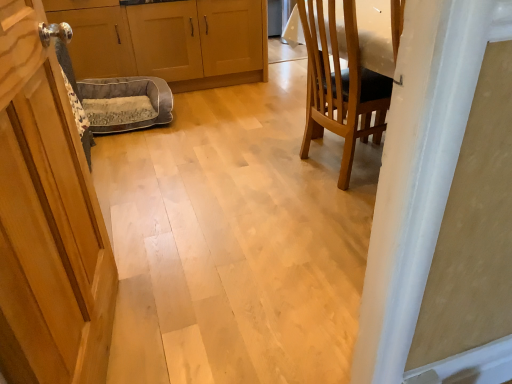
Measure the distance between point (x=375, y=93) and camera.

Point (x=375, y=93) is 1.95 meters away from camera.

What do you see at coordinates (96, 37) in the screenshot? I see `wooden cabinet at left, which appears as the second cabinetry when viewed from the right` at bounding box center [96, 37].

This screenshot has width=512, height=384. I want to click on wooden chair at right, so click(x=340, y=84).

Is matte wood cabinets at center, positioned as the first cabinetry in right-to-left order, at the back of wooden chair at right?

wooden chair at right does not have its back to matte wood cabinets at center, positioned as the first cabinetry in right-to-left order.

Considering the sizes of objects wooden chair at right and matte wood cabinets at center, acting as the 2th cabinetry starting from the left, in the image provided, who is wider, wooden chair at right or matte wood cabinets at center, acting as the 2th cabinetry starting from the left,?

matte wood cabinets at center, acting as the 2th cabinetry starting from the left, is wider.

Does wooden chair at right have a larger size compared to matte wood cabinets at center, positioned as the first cabinetry in right-to-left order?

Actually, wooden chair at right might be smaller than matte wood cabinets at center, positioned as the first cabinetry in right-to-left order.

Is matte wood cabinets at center, positioned as the first cabinetry in right-to-left order, positioned far away from wooden door at left?

matte wood cabinets at center, positioned as the first cabinetry in right-to-left order, is positioned a significant distance from wooden door at left.

Can you confirm if matte wood cabinets at center, positioned as the first cabinetry in right-to-left order, is smaller than wooden door at left?

Actually, matte wood cabinets at center, positioned as the first cabinetry in right-to-left order, might be larger than wooden door at left.

Is matte wood cabinets at center, positioned as the first cabinetry in right-to-left order, shorter than wooden door at left?

Indeed, matte wood cabinets at center, positioned as the first cabinetry in right-to-left order, has a lesser height compared to wooden door at left.

Which is less distant, (184, 3) or (40, 5)?

The point (40, 5) is closer.

Considering the relative sizes of wooden cabinet at left, which appears as the second cabinetry when viewed from the right, and wooden chair at right in the image provided, is wooden cabinet at left, which appears as the second cabinetry when viewed from the right, shorter than wooden chair at right?

Correct, wooden cabinet at left, which appears as the second cabinetry when viewed from the right, is not as tall as wooden chair at right.

From the wooden chair at right, count 1st cabinetrys backward and point to it. Please provide its 2D coordinates.

[(96, 37)]

Can you confirm if wooden cabinet at left, the first cabinetry when ordered from left to right, is smaller than wooden chair at right?

No, wooden cabinet at left, the first cabinetry when ordered from left to right, is not smaller than wooden chair at right.

From the image's perspective, which one is positioned higher, wooden cabinet at left, the first cabinetry when ordered from left to right, or wooden chair at right?

From the image's view, wooden cabinet at left, the first cabinetry when ordered from left to right, is above.

Is matte wood cabinets at center, positioned as the first cabinetry in right-to-left order, placed right next to wooden chair at right?

matte wood cabinets at center, positioned as the first cabinetry in right-to-left order, and wooden chair at right are not in contact.

What's the angular difference between matte wood cabinets at center, acting as the 2th cabinetry starting from the left, and wooden chair at right's facing directions?

90 degrees.

Considering the relative sizes of matte wood cabinets at center, acting as the 2th cabinetry starting from the left, and wooden chair at right in the image provided, is matte wood cabinets at center, acting as the 2th cabinetry starting from the left, thinner than wooden chair at right?

No, matte wood cabinets at center, acting as the 2th cabinetry starting from the left, is not thinner than wooden chair at right.

From a real-world perspective, which is physically above, matte wood cabinets at center, positioned as the first cabinetry in right-to-left order, or wooden chair at right?

wooden chair at right.

Does wooden door at left touch wooden cabinet at left, the first cabinetry when ordered from left to right?

wooden door at left is not next to wooden cabinet at left, the first cabinetry when ordered from left to right, and they're not touching.

Which of these two, wooden door at left or wooden cabinet at left, which appears as the second cabinetry when viewed from the right, is smaller?

Smaller between the two is wooden door at left.

Is wooden door at left oriented away from wooden cabinet at left, the first cabinetry when ordered from left to right?

No.

Does point (92, 352) come in front of point (81, 46)?

Yes, point (92, 352) is in front of point (81, 46).

From a real-world perspective, does wooden chair at right stand above wooden door at left?

Actually, wooden chair at right is physically below wooden door at left in the real world.

Relative to wooden door at left, is wooden chair at right in front or behind?

Clearly, wooden chair at right is behind wooden door at left.

Is wooden chair at right turned away from wooden door at left?

No, wooden chair at right is not facing the opposite direction of wooden door at left.

Is point (347, 83) closer or farther from the camera than point (21, 55)?

Point (347, 83).

Looking at this image, which point is more forward, [138,84] or [115,66]?

Point [138,84]

Considering the relative sizes of gray fabric dog bed at center and wooden cabinet at left, the first cabinetry when ordered from left to right, in the image provided, is gray fabric dog bed at center taller than wooden cabinet at left, the first cabinetry when ordered from left to right,?

Incorrect, the height of gray fabric dog bed at center is not larger of that of wooden cabinet at left, the first cabinetry when ordered from left to right.

Looking at their sizes, would you say gray fabric dog bed at center is wider or thinner than wooden cabinet at left, which appears as the second cabinetry when viewed from the right?

In the image, gray fabric dog bed at center appears to be more narrow than wooden cabinet at left, which appears as the second cabinetry when viewed from the right.

I want to click on the 2nd cabinetry behind the wooden chair at right, so click(x=168, y=40).

Where is `cabinetry lying on the right of wooden door at left`? The height and width of the screenshot is (384, 512). cabinetry lying on the right of wooden door at left is located at coordinates (168, 40).

Based on their spatial positions, is wooden cabinet at left, the first cabinetry when ordered from left to right, or matte wood cabinets at center, positioned as the first cabinetry in right-to-left order, closer to gray fabric dog bed at center?

Among the two, wooden cabinet at left, the first cabinetry when ordered from left to right, is located nearer to gray fabric dog bed at center.

When comparing their distances from gray fabric dog bed at center, does wooden door at left or wooden chair at right seem closer?

wooden chair at right is closer to gray fabric dog bed at center.

Based on their spatial positions, is wooden door at left or wooden chair at right closer to matte wood cabinets at center, positioned as the first cabinetry in right-to-left order?

Based on the image, wooden chair at right appears to be nearer to matte wood cabinets at center, positioned as the first cabinetry in right-to-left order.

Which object lies nearer to the anchor point wooden door at left, gray fabric dog bed at center or wooden cabinet at left, the first cabinetry when ordered from left to right?

gray fabric dog bed at center lies closer to wooden door at left than the other object.

When comparing their distances from wooden cabinet at left, the first cabinetry when ordered from left to right, does matte wood cabinets at center, acting as the 2th cabinetry starting from the left, or wooden chair at right seem closer?

Based on the image, matte wood cabinets at center, acting as the 2th cabinetry starting from the left, appears to be nearer to wooden cabinet at left, the first cabinetry when ordered from left to right.

When comparing their distances from gray fabric dog bed at center, does wooden chair at right or matte wood cabinets at center, positioned as the first cabinetry in right-to-left order, seem closer?

matte wood cabinets at center, positioned as the first cabinetry in right-to-left order, is positioned closer to the anchor gray fabric dog bed at center.

When comparing their distances from wooden chair at right, does matte wood cabinets at center, positioned as the first cabinetry in right-to-left order, or gray fabric dog bed at center seem further?

The object further to wooden chair at right is matte wood cabinets at center, positioned as the first cabinetry in right-to-left order.

Which object lies further to the anchor point wooden cabinet at left, which appears as the second cabinetry when viewed from the right, wooden chair at right or matte wood cabinets at center, positioned as the first cabinetry in right-to-left order?

wooden chair at right.

Where is `chair located between wooden door at left and wooden cabinet at left, the first cabinetry when ordered from left to right, in the depth direction`? chair located between wooden door at left and wooden cabinet at left, the first cabinetry when ordered from left to right, in the depth direction is located at coordinates (340, 84).

The image size is (512, 384). Identify the location of chair between wooden door at left and gray fabric dog bed at center in the front-back direction. (340, 84).

You are a GUI agent. You are given a task and a screenshot of the screen. Output one action in this format:
    pyautogui.click(x=<x>, y=<y>)
    Task: Click on the dog bed between wooden cabinet at left, which appears as the second cabinetry when viewed from the right, and wooden chair at right, in the horizontal direction
    The image size is (512, 384).
    Given the screenshot: What is the action you would take?
    [x=126, y=103]

Identify the location of dog bed between wooden door at left and wooden cabinet at left, the first cabinetry when ordered from left to right, from front to back. This screenshot has width=512, height=384. (126, 103).